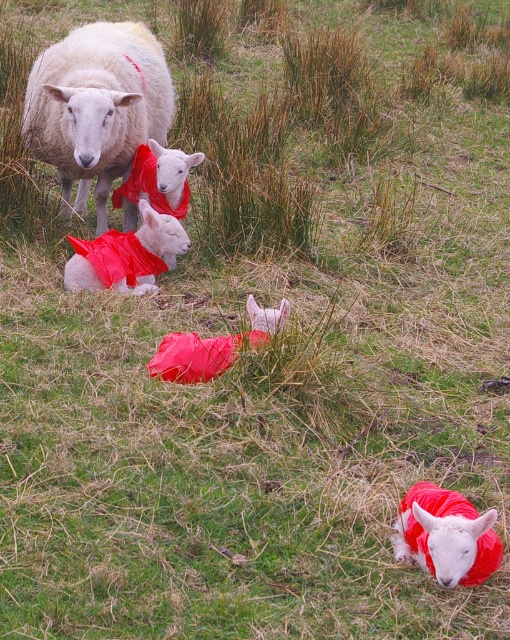
Is white woolen sheep at upper left bigger than matte red coat at center?

Correct, white woolen sheep at upper left is larger in size than matte red coat at center.

Does point (112, 24) come behind point (112, 276)?

Yes, point (112, 24) is farther from viewer.

What are the coordinates of `white woolen sheep at upper left` in the screenshot? It's located at (96, 106).

Does matte red coat at lower right have a lesser width compared to matte red coat at center?

Correct, matte red coat at lower right's width is less than matte red coat at center's.

Is matte red coat at lower right taller than matte red coat at center?

No.

Measure the distance between point (438, 529) and camera.

Point (438, 529) and camera are 8.97 feet apart.

This screenshot has width=510, height=640. I want to click on matte red coat at lower right, so click(446, 536).

The height and width of the screenshot is (640, 510). What are the coordinates of `white woolen sheep at upper left` in the screenshot? It's located at (96, 106).

Which of these two, white woolen sheep at upper left or matte red coat at lower right, stands taller?

white woolen sheep at upper left

This screenshot has width=510, height=640. I want to click on white woolen sheep at upper left, so click(x=96, y=106).

Find the location of a particular element. This screenshot has height=640, width=510. white woolen sheep at upper left is located at coordinates (96, 106).